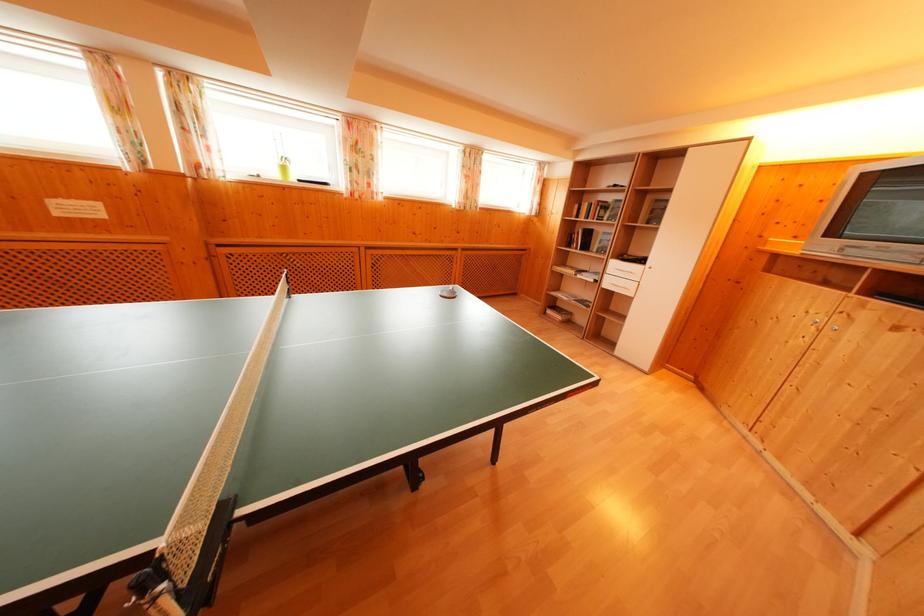
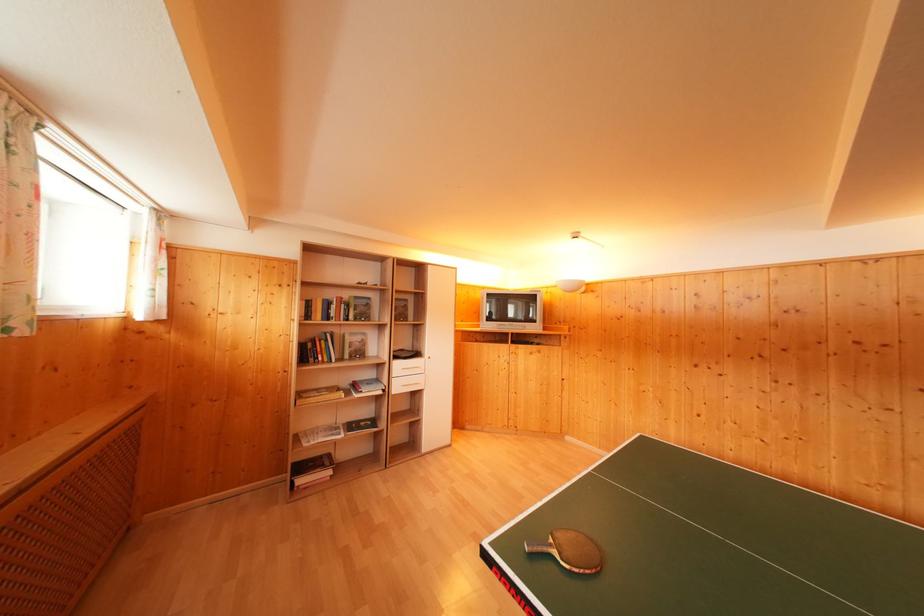
Find the pixel in the second image that matches (614,276) in the first image.

(398, 379)